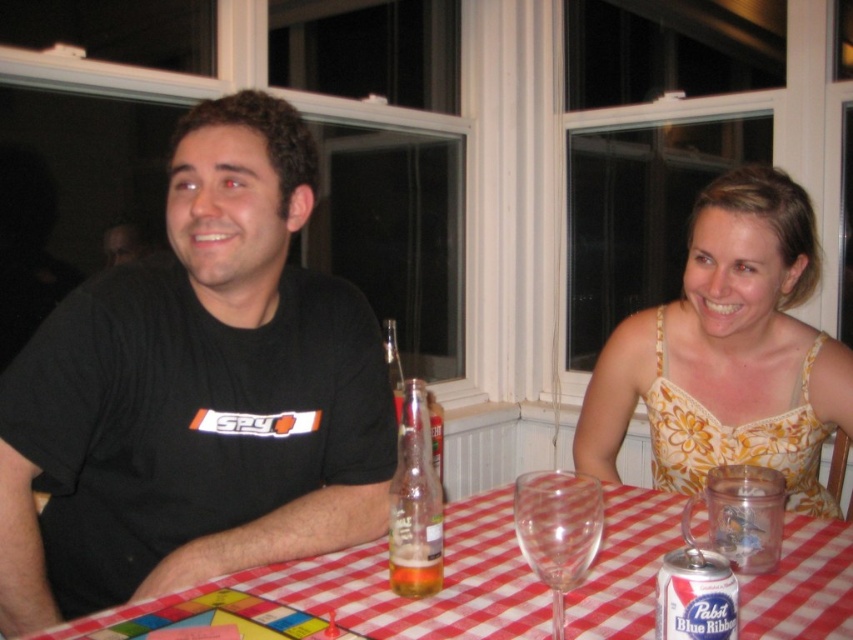
You are a photographer setting up for a group photo. You need to ensure that the yellow floral dress at center and the pabst blue ribbon can at table are both visible in the frame. Given their sizes, which object should you focus on to ensure both are in focus?

The yellow floral dress at center is larger in size than the pabst blue ribbon can at table, so you should focus on the yellow floral dress at center to ensure both are in focus.

You are a photographer standing at point (64, 474). You need to take a photo of the two people seated at the table. Can you fit both of them in the frame without moving your position?

The two people are 3.34 feet apart. Since you are positioned at point (64, 474), which is likely close enough to capture both individuals in the frame, you can take the photo without moving.

You are a photographer setting up for a portrait. You want to ensure that the red checkered tablecloth at lower center and the translucent glass bottle at table center are both visible in the frame. Given their heights, which object might require you to adjust your camera angle to avoid being blocked?

The translucent glass bottle at table center is taller than the red checkered tablecloth at lower center, so it might block the view of the tablecloth if not adjusted. Lowering the camera angle could help capture both.